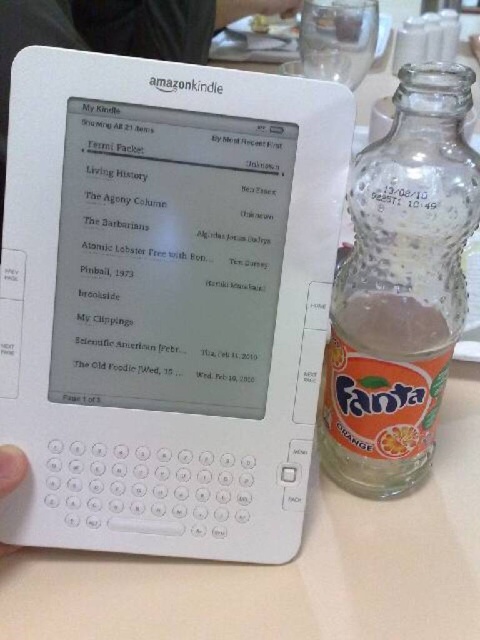
You are placing a white matte amazon kindle at center and a matte plastic fork at upper center on a table. According to the scene, which object is more to the left?

The white matte amazon kindle at center is more to the left than the matte plastic fork at upper center because it is positioned on the left side of it.

You are a delivery person who just received a white matte Amazon Kindle at center and a skinny white hand at lower left. You need to place both items on a shelf that can only hold items wider than the hand. Will both items fit?

The white matte Amazon Kindle at center is wider than the skinny white hand at lower left, so the Kindle will fit on the shelf. However, the skinny white hand at lower left might not be an item to place on the shelf as it is part of a person.

You are a chef holding a matte plastic fork at upper center and need to reach the white matte amazon kindle at center to check a recipe. Can you safely pick up the kindle without dropping the fork?

The distance between the white matte amazon kindle at center and the matte plastic fork at upper center is 32.06 inches, so you can safely reach the kindle without dropping the fork since the distance is manageable.